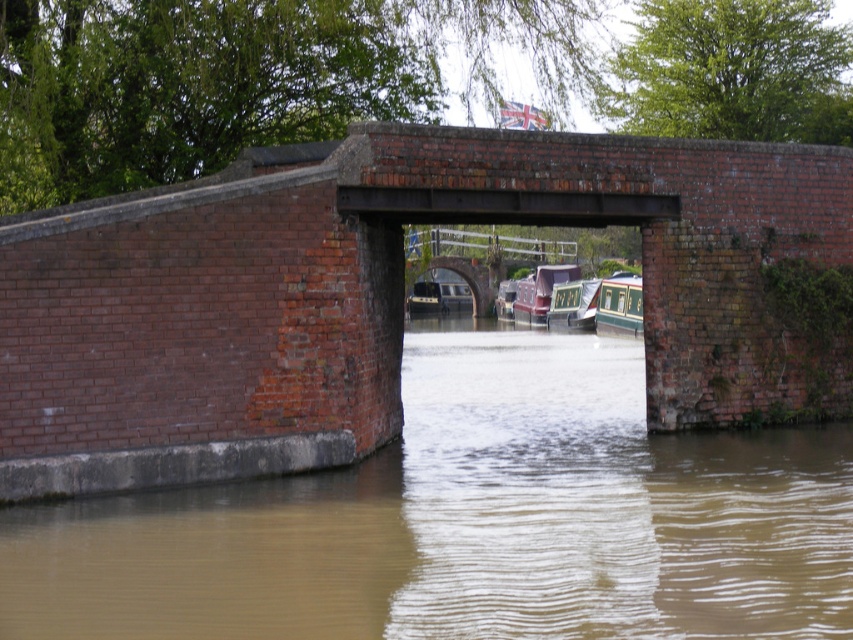
Question: Does brick wall at center have a greater width compared to brown muddy water at center?

Choices:
 (A) no
 (B) yes

Answer: (B)

Question: Which point is closer to the camera taking this photo?

Choices:
 (A) (370, 496)
 (B) (624, 320)

Answer: (A)

Question: Does green glossy boat at center have a larger size compared to green glossy canal boat at center?

Choices:
 (A) no
 (B) yes

Answer: (B)

Question: Does brick wall at center have a lesser width compared to green glossy canal boat at center?

Choices:
 (A) no
 (B) yes

Answer: (A)

Question: Which point is closer to the camera taking this photo?

Choices:
 (A) (531, 284)
 (B) (567, 323)

Answer: (B)

Question: Among these points, which one is farthest from the camera?

Choices:
 (A) (61, 426)
 (B) (386, 452)
 (C) (601, 296)

Answer: (C)